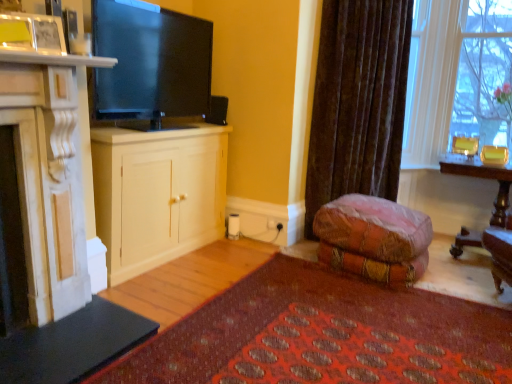
Question: From a real-world perspective, is white wood cabinet at center, the 1th cabinetry in the back-to-front sequence, physically below velvet brown curtain at center?

Choices:
 (A) no
 (B) yes

Answer: (B)

Question: Is white wood cabinet at center, which is counted as the second cabinetry, starting from the front, in contact with velvet brown curtain at center?

Choices:
 (A) yes
 (B) no

Answer: (B)

Question: From a real-world perspective, is white wood cabinet at center, the 1th cabinetry in the back-to-front sequence, located higher than velvet brown curtain at center?

Choices:
 (A) yes
 (B) no

Answer: (B)

Question: Considering the relative sizes of white wood cabinet at center, the 1th cabinetry in the back-to-front sequence, and velvet brown curtain at center in the image provided, is white wood cabinet at center, the 1th cabinetry in the back-to-front sequence, thinner than velvet brown curtain at center?

Choices:
 (A) yes
 (B) no

Answer: (B)

Question: Is there a large distance between white wood cabinet at center, which is counted as the second cabinetry, starting from the front, and velvet brown curtain at center?

Choices:
 (A) yes
 (B) no

Answer: (A)

Question: In terms of height, does wooden polished desk at right look taller or shorter compared to velvet brown curtain at center?

Choices:
 (A) tall
 (B) short

Answer: (B)

Question: From the image's perspective, relative to velvet brown curtain at center, is wooden polished desk at right above or below?

Choices:
 (A) above
 (B) below

Answer: (B)

Question: Considering the positions of point (503, 185) and point (357, 117), is point (503, 185) closer or farther from the camera than point (357, 117)?

Choices:
 (A) closer
 (B) farther

Answer: (A)

Question: Considering their positions, is wooden polished desk at right located in front of or behind velvet brown curtain at center?

Choices:
 (A) behind
 (B) front

Answer: (B)

Question: From the image's perspective, is matte black tv at upper center above or below wooden polished desk at right?

Choices:
 (A) above
 (B) below

Answer: (A)

Question: Is matte black tv at upper center wider or thinner than wooden polished desk at right?

Choices:
 (A) wide
 (B) thin

Answer: (B)

Question: Based on their sizes in the image, would you say matte black tv at upper center is bigger or smaller than wooden polished desk at right?

Choices:
 (A) big
 (B) small

Answer: (B)

Question: Is point pos(163,59) positioned closer to the camera than point pos(494,210)?

Choices:
 (A) closer
 (B) farther

Answer: (A)

Question: Is white marble fireplace at left, which is counted as the second cabinetry, starting from the back, situated inside white wood cabinet at center, the 1th cabinetry in the back-to-front sequence, or outside?

Choices:
 (A) outside
 (B) inside

Answer: (A)

Question: Is white marble fireplace at left, marked as the first cabinetry in a front-to-back arrangement, bigger or smaller than white wood cabinet at center, which is counted as the second cabinetry, starting from the front?

Choices:
 (A) small
 (B) big

Answer: (A)